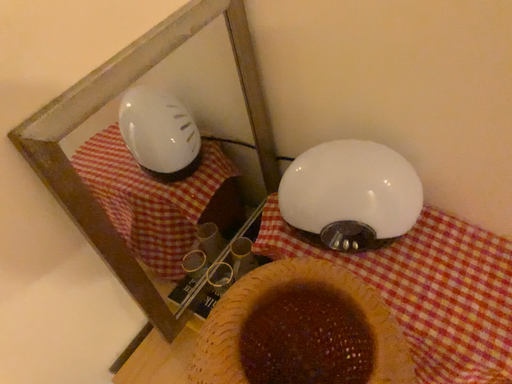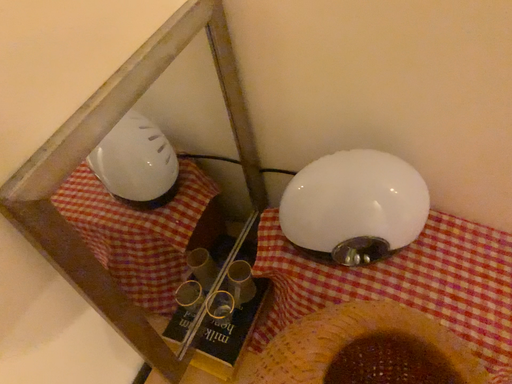
Question: How did the camera likely rotate when shooting the video?

Choices:
 (A) rotated left
 (B) rotated right

Answer: (B)